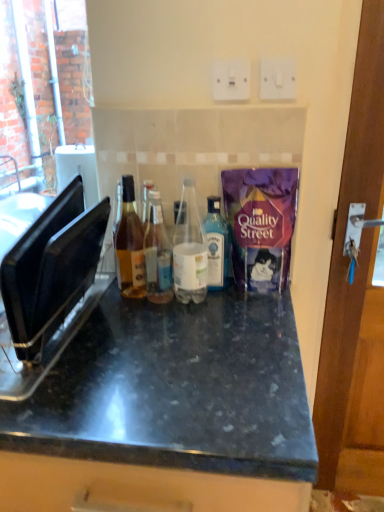
The height and width of the screenshot is (512, 384). I want to click on free location to the right of amber glass bottle at center, which is counted as the 4th bottle, starting from the right, so click(x=220, y=311).